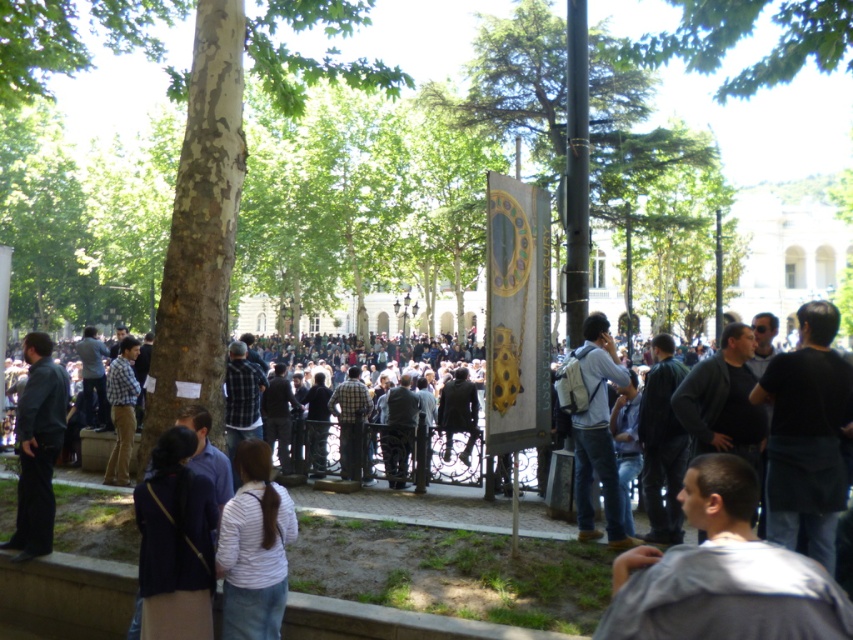
Is dark blue shirt at left below plaid fabric shirt at center?

Correct, dark blue shirt at left is located below plaid fabric shirt at center.

The image size is (853, 640). What do you see at coordinates (38, 445) in the screenshot? I see `dark blue shirt at left` at bounding box center [38, 445].

I want to click on dark blue shirt at left, so click(x=38, y=445).

Is the position of green leafy tree at upper center less distant than that of dark blue shirt at left?

No, it is behind dark blue shirt at left.

Is green leafy tree at upper center above dark blue shirt at left?

Indeed, green leafy tree at upper center is positioned over dark blue shirt at left.

Does point (675, 44) come farther from viewer compared to point (20, 445)?

Yes, it is behind point (20, 445).

I want to click on green leafy tree at upper center, so point(798,45).

From the picture: Who is taller, dark purple sweater at lower left or plaid fabric shirt at center?

plaid fabric shirt at center is taller.

Does dark purple sweater at lower left have a lesser height compared to plaid fabric shirt at center?

Correct, dark purple sweater at lower left is not as tall as plaid fabric shirt at center.

Measure the distance between dark purple sweater at lower left and camera.

They are 22.99 meters apart.

Locate an element on the screen. dark purple sweater at lower left is located at coordinates (175, 541).